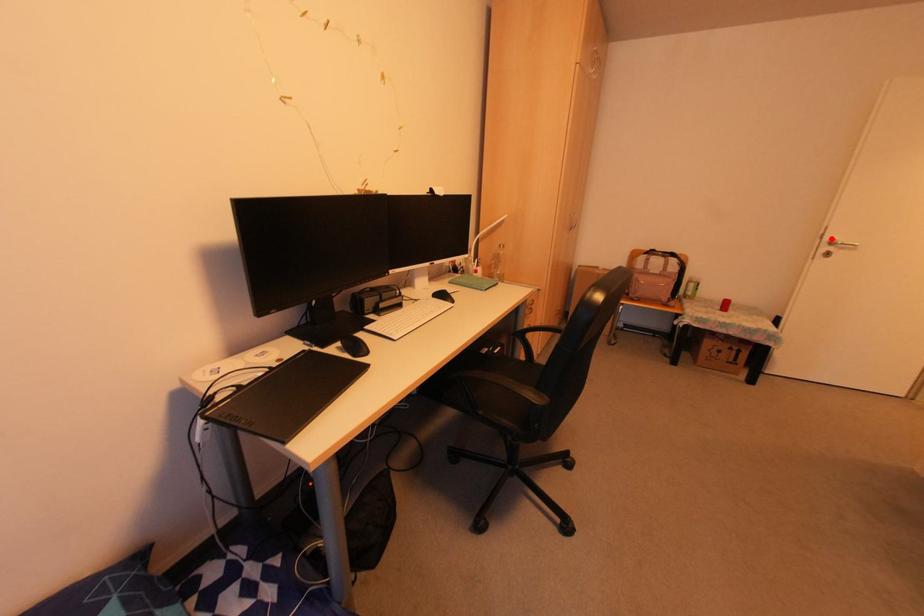
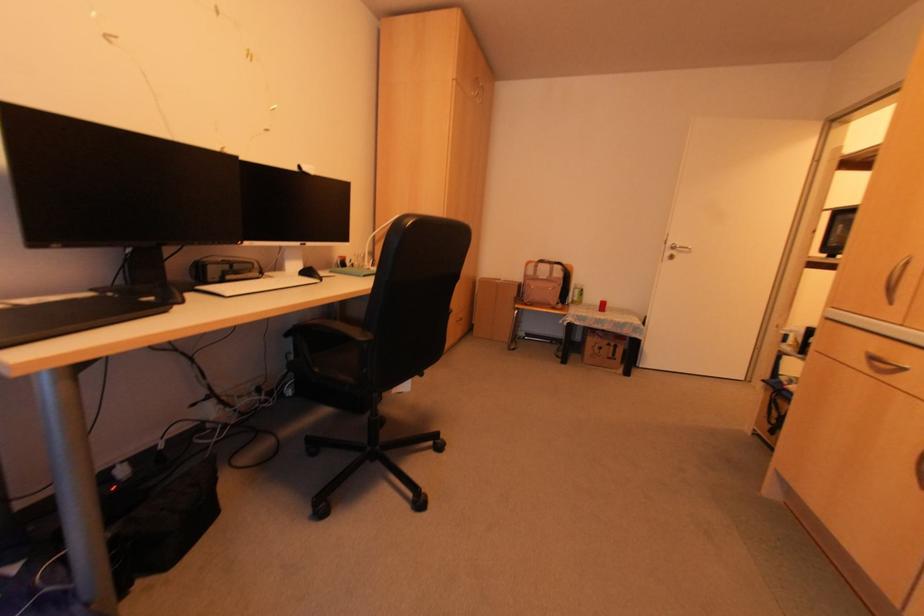
In the second image, find the point that corresponds to the highlighted location in the first image.

(671, 245)